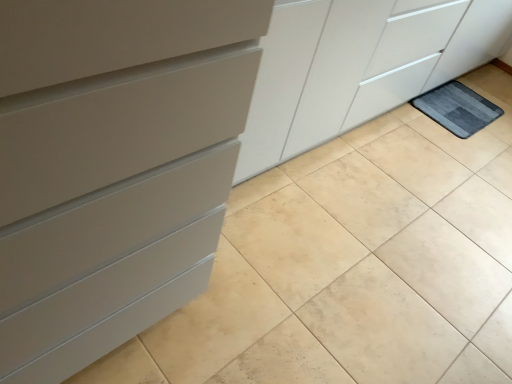
Question: In terms of width, does gray textured bath mat at lower right look wider or thinner when compared to matte gray chest of drawers at left?

Choices:
 (A) thin
 (B) wide

Answer: (A)

Question: Considering the positions of gray textured bath mat at lower right and matte gray chest of drawers at left in the image, is gray textured bath mat at lower right bigger or smaller than matte gray chest of drawers at left?

Choices:
 (A) big
 (B) small

Answer: (B)

Question: From the image's perspective, is gray textured bath mat at lower right above or below matte gray chest of drawers at left?

Choices:
 (A) above
 (B) below

Answer: (A)

Question: From a real-world perspective, relative to gray textured bath mat at lower right, is matte gray chest of drawers at left vertically above or below?

Choices:
 (A) above
 (B) below

Answer: (A)

Question: Which is correct: matte gray chest of drawers at left is inside gray textured bath mat at lower right, or outside of it?

Choices:
 (A) inside
 (B) outside

Answer: (B)

Question: Looking at the image, does matte gray chest of drawers at left seem bigger or smaller compared to gray textured bath mat at lower right?

Choices:
 (A) small
 (B) big

Answer: (B)

Question: Is matte gray chest of drawers at left taller or shorter than gray textured bath mat at lower right?

Choices:
 (A) short
 (B) tall

Answer: (B)